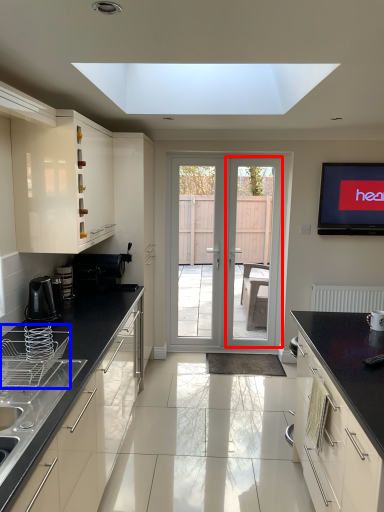
Question: Which of the following is the farthest to the observer, screen door (highlighted by a red box) or appliance (highlighted by a blue box)?

Choices:
 (A) screen door
 (B) appliance

Answer: (A)